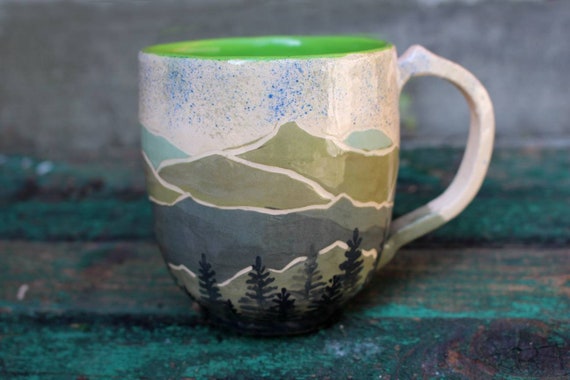
Find the location of a particular element. This screenshot has height=380, width=570. coffee mug is located at coordinates (243, 177).